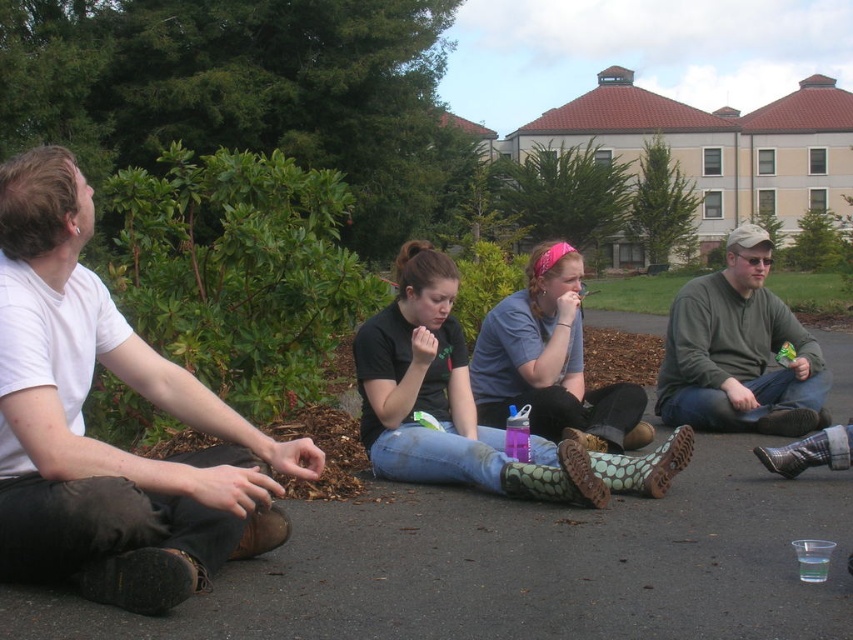
Question: Among these objects, which one is nearest to the camera?

Choices:
 (A) denim jeans at center
 (B) white cotton shirt at left

Answer: (B)

Question: Among these points, which one is farthest from the camera?

Choices:
 (A) (746, 234)
 (B) (494, 328)

Answer: (A)

Question: Is white cotton shirt at left further to camera compared to dark gray sweater at center?

Choices:
 (A) no
 (B) yes

Answer: (A)

Question: Which object is closer to the camera taking this photo?

Choices:
 (A) dark gray sweater at center
 (B) denim jeans at center
 (C) white cotton shirt at left

Answer: (C)

Question: Is white cotton shirt at left smaller than dark gray sweater at center?

Choices:
 (A) no
 (B) yes

Answer: (B)

Question: Can you confirm if white cotton shirt at left is bigger than dark gray sweater at center?

Choices:
 (A) no
 (B) yes

Answer: (A)